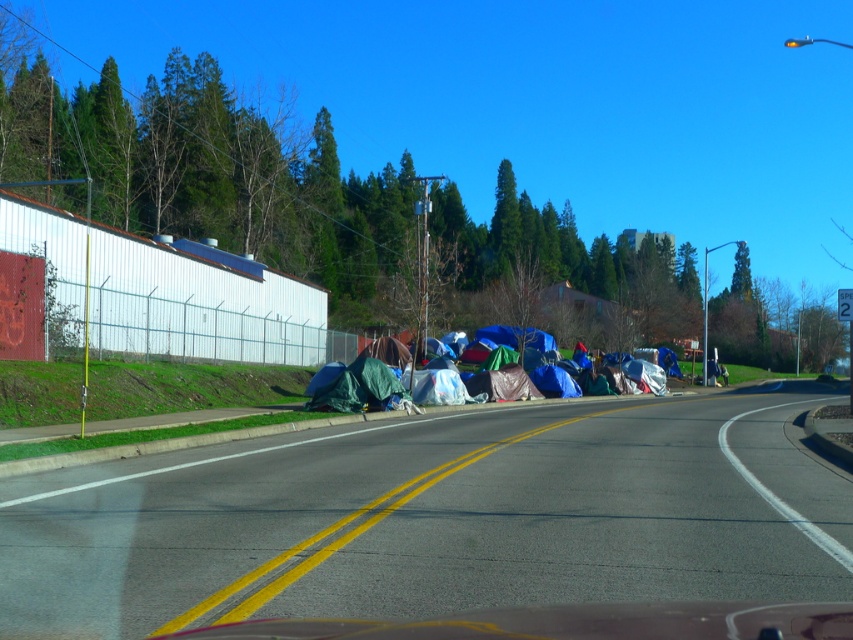
Question: Which object is farther from the camera taking this photo?

Choices:
 (A) asphalt road at lower center
 (B) multicolored tarpaulin tents at center

Answer: (B)

Question: Which object appears farthest from the camera in this image?

Choices:
 (A) multicolored tarpaulin tents at center
 (B) asphalt road at lower center

Answer: (A)

Question: Which of the following is the closest to the observer?

Choices:
 (A) multicolored tarpaulin tents at center
 (B) asphalt road at lower center

Answer: (B)

Question: Can you confirm if asphalt road at lower center is thinner than multicolored tarpaulin tents at center?

Choices:
 (A) no
 (B) yes

Answer: (A)

Question: Can you confirm if asphalt road at lower center is positioned above multicolored tarpaulin tents at center?

Choices:
 (A) no
 (B) yes

Answer: (A)

Question: Is asphalt road at lower center in front of multicolored tarpaulin tents at center?

Choices:
 (A) no
 (B) yes

Answer: (B)